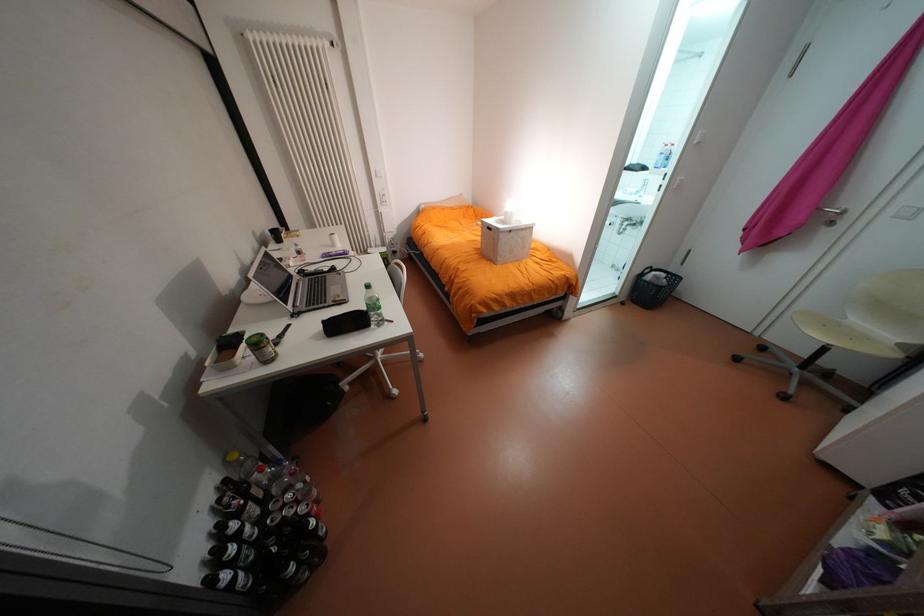
Find where to sit the chair sitting surface. Please return your answer as a coordinate pair (x, y).

(824, 328)